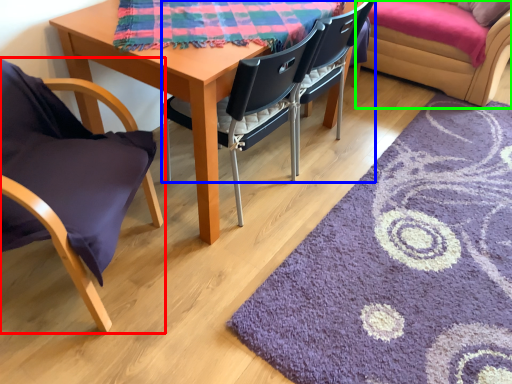
Question: Which object is positioned farthest from chair (highlighted by a red box)? Select from chair (highlighted by a blue box) and couch (highlighted by a green box).

Choices:
 (A) chair
 (B) couch

Answer: (B)